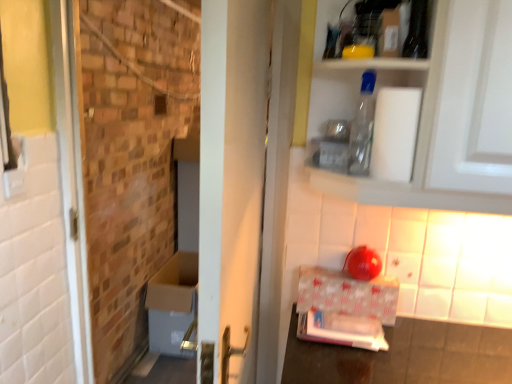
Question: Considering the positions of transparent plastic bottle at upper center and brickwork at left in the image, is transparent plastic bottle at upper center bigger or smaller than brickwork at left?

Choices:
 (A) big
 (B) small

Answer: (B)

Question: Is point (366, 120) closer or farther from the camera than point (145, 226)?

Choices:
 (A) closer
 (B) farther

Answer: (A)

Question: Which of these objects is positioned closest to the white matte toilet paper at upper right?

Choices:
 (A) transparent plastic bottle at upper center
 (B) white glossy door at center
 (C) white glossy cardboard box at lower right
 (D) brickwork at left

Answer: (A)

Question: Estimate the real-world distances between objects in this image. Which object is farther from the white glossy cardboard box at lower right?

Choices:
 (A) white glossy door at center
 (B) brickwork at left
 (C) white matte toilet paper at upper right
 (D) transparent plastic bottle at upper center

Answer: (B)